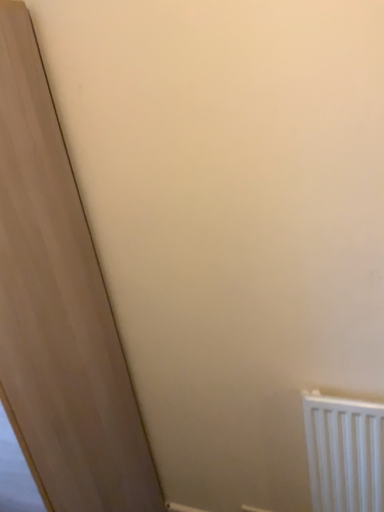
This screenshot has width=384, height=512. What do you see at coordinates (59, 309) in the screenshot?
I see `light brown wood door at left` at bounding box center [59, 309].

Locate an element on the screen. light brown wood door at left is located at coordinates (59, 309).

What is the approximate width of light brown wood door at left?

light brown wood door at left is 19.86 inches in width.

You are a GUI agent. You are given a task and a screenshot of the screen. Output one action in this format:
    pyautogui.click(x=<x>, y=<y>)
    Task: Click on the light brown wood door at left
    Image resolution: width=384 pixels, height=512 pixels.
    Given the screenshot: What is the action you would take?
    pyautogui.click(x=59, y=309)